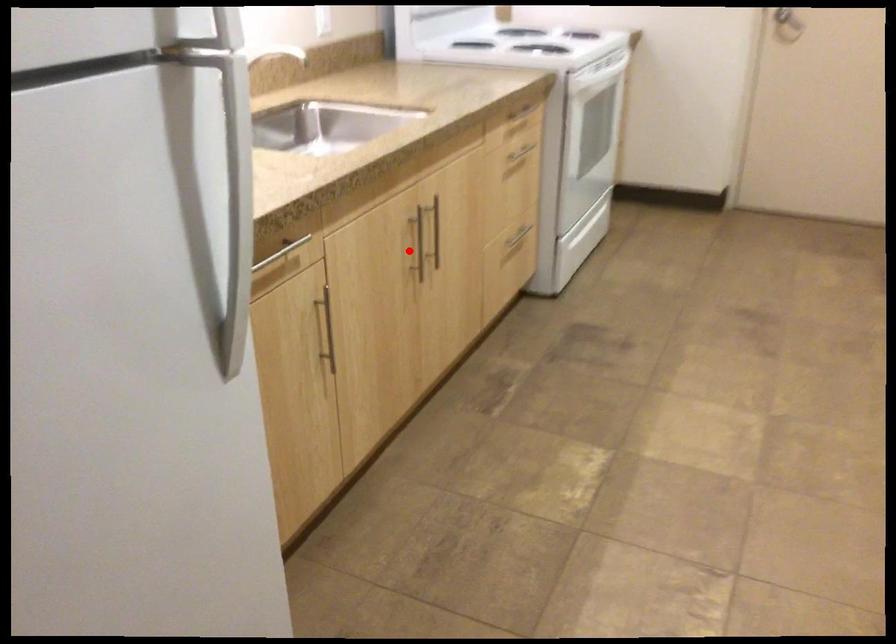
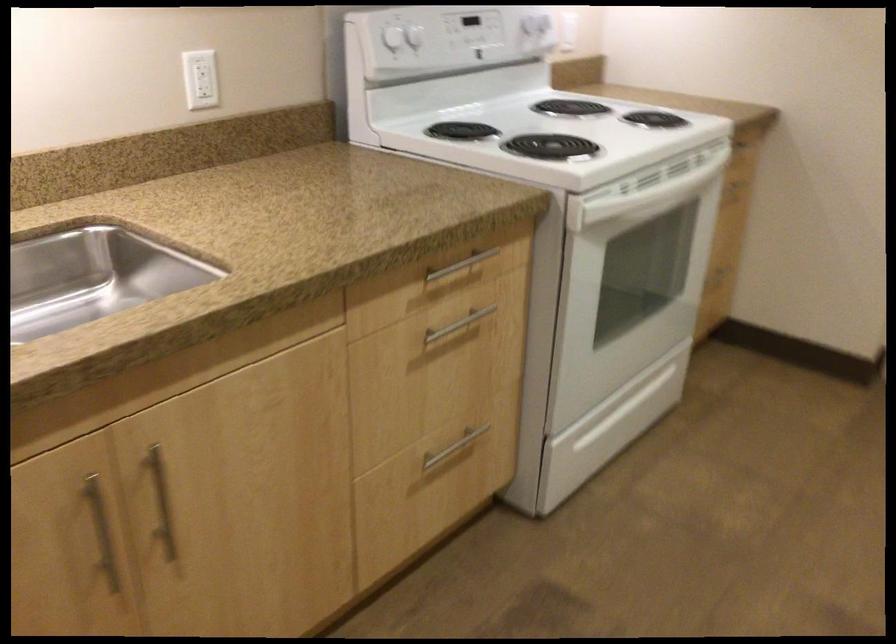
In the second image, find the point that corresponds to the highlighted location in the first image.

(101, 532)